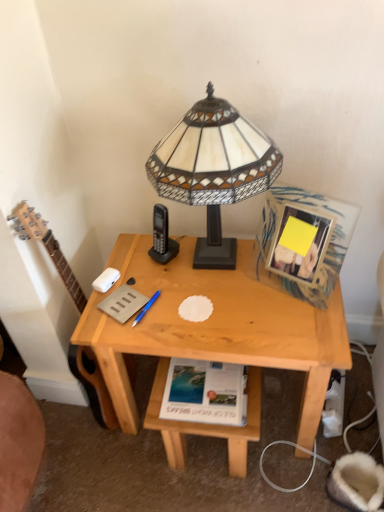
Where is `free space in front of stained glass lampshade at center`? free space in front of stained glass lampshade at center is located at coordinates (246, 323).